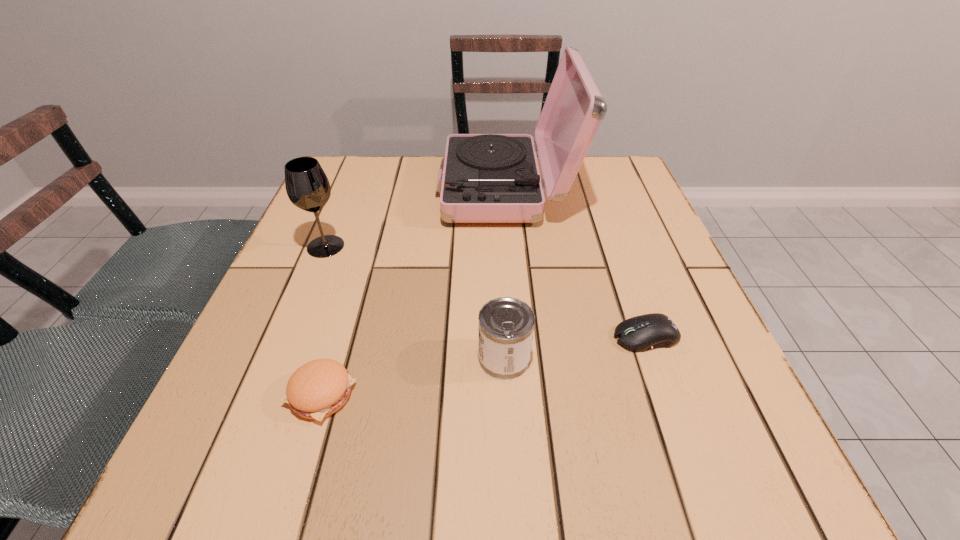
Identify the location of blank region between the fourth shortest object and the record player. The image size is (960, 540). (416, 218).

Locate an element on the screen. The width and height of the screenshot is (960, 540). object that is the third closest to the fourth tallest object is located at coordinates (487, 178).

Select which object is the third closest to the fourth tallest object. Please provide its 2D coordinates. Your answer should be formatted as a tuple, i.e. [(x, y)], where the tuple contains the x and y coordinates of a point satisfying the conditions above.

[(487, 178)]

Find the location of a particular element. blank space that satisfies the following two spatial constraints: 1. with the lid open on the farthest object; 2. on the back side of the shortest object is located at coordinates (517, 336).

This screenshot has width=960, height=540. In order to click on free space that satisfies the following two spatial constraints: 1. with the lid open on the computer equipment; 2. on the right side of the record player in this screenshot , I will do `click(517, 336)`.

Locate an element on the screen. This screenshot has height=540, width=960. vacant position in the image that satisfies the following two spatial constraints: 1. with the lid open on the farthest object; 2. on the left side of the computer equipment is located at coordinates (517, 336).